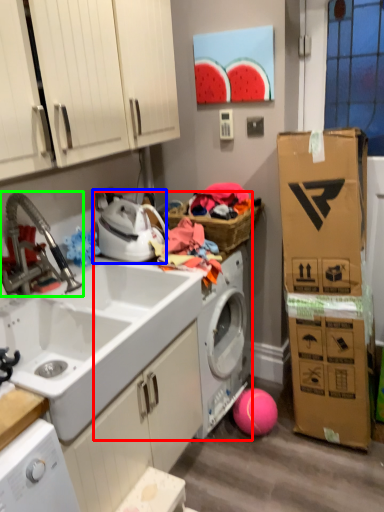
Question: Considering the real-world distances, which object is closest to washing machine (highlighted by a red box)? appliance (highlighted by a blue box) or faucet (highlighted by a green box).

Choices:
 (A) appliance
 (B) faucet

Answer: (A)